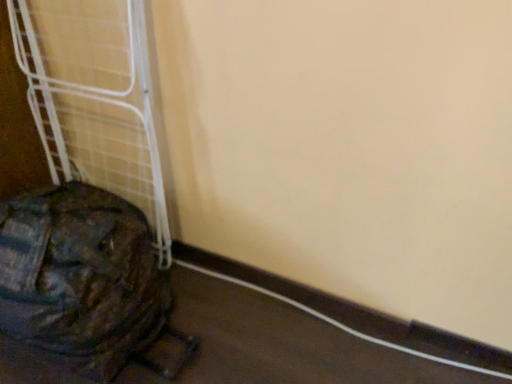
What do you see at coordinates (84, 280) in the screenshot? I see `camouflage fabric backpack at lower left` at bounding box center [84, 280].

Find the location of `camouflage fabric backpack at lower left`. camouflage fabric backpack at lower left is located at coordinates (84, 280).

Where is `camouflage fabric backpack at lower left`? camouflage fabric backpack at lower left is located at coordinates (84, 280).